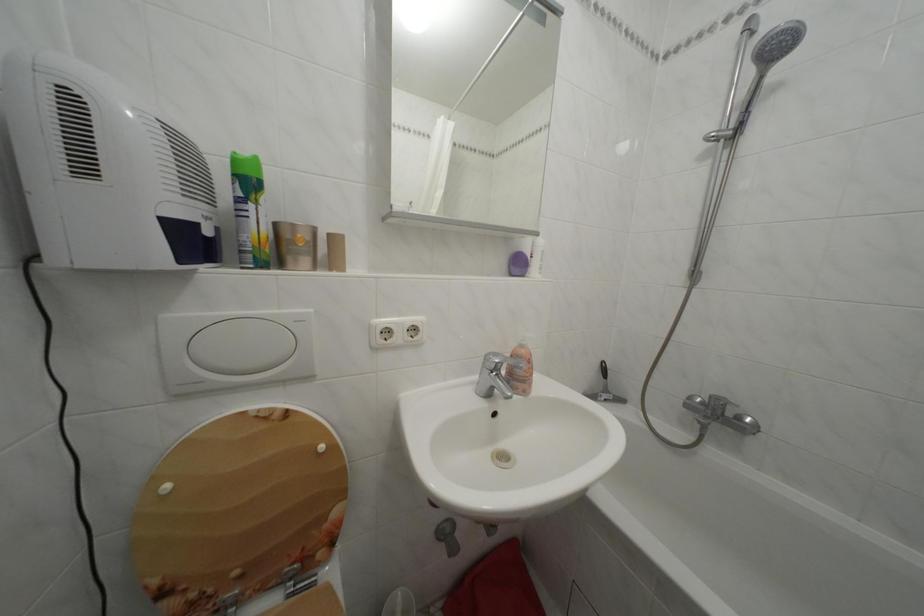
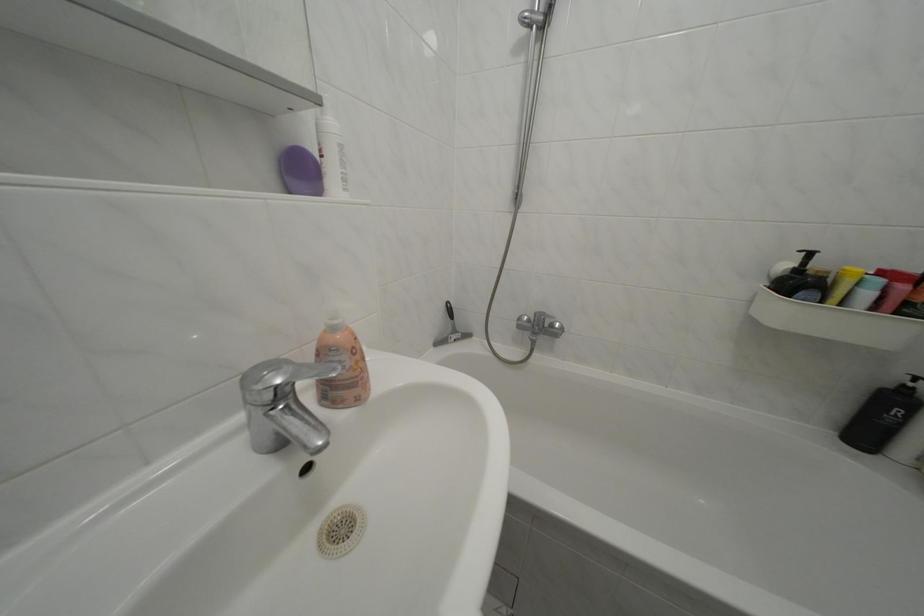
In the second image, find the point that corresponds to pixel 530 352 in the first image.

(342, 334)